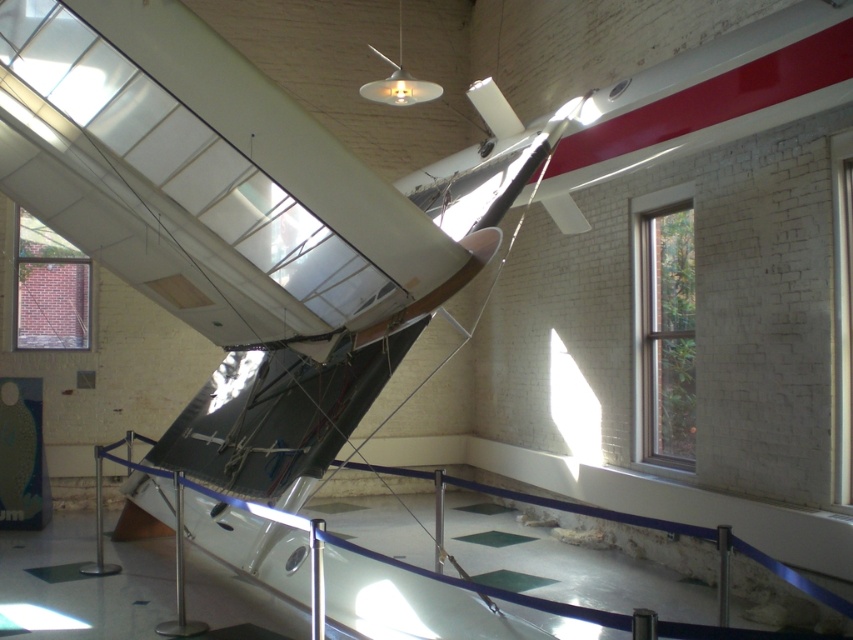
Question: Considering the real-world distances, which object is farthest from the brick wall at upper left?

Choices:
 (A) clear glass window at upper right
 (B) clear glass window at right

Answer: (A)

Question: Which of the following is the farthest from the observer?

Choices:
 (A) (65, 273)
 (B) (666, 289)
 (C) (844, 275)

Answer: (A)

Question: Considering the relative positions of clear glass window at right and clear glass window at upper right in the image provided, where is clear glass window at right located with respect to clear glass window at upper right?

Choices:
 (A) right
 (B) left

Answer: (B)

Question: Estimate the real-world distances between objects in this image. Which object is farther from the brick wall at upper left?

Choices:
 (A) clear glass window at right
 (B) clear glass window at upper right

Answer: (B)

Question: Can you confirm if brick wall at upper left is positioned above clear glass window at upper right?

Choices:
 (A) yes
 (B) no

Answer: (A)

Question: Is brick wall at upper left thinner than clear glass window at upper right?

Choices:
 (A) no
 (B) yes

Answer: (A)